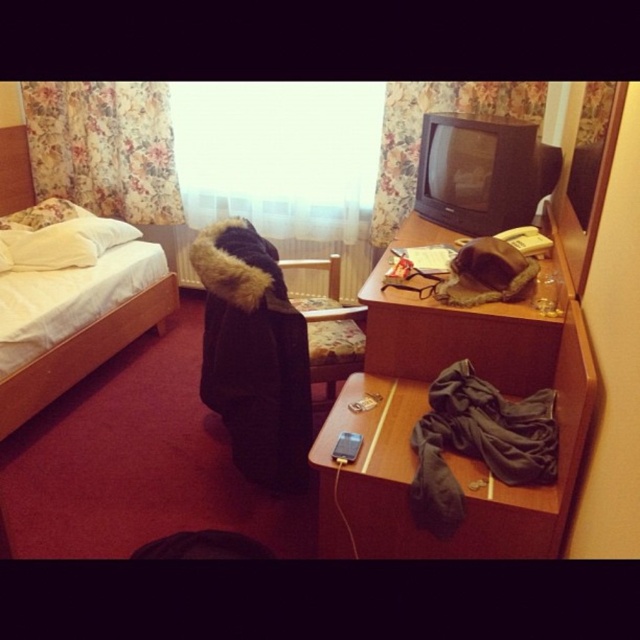
Question: Is wooden desk at center thinner than black fur-trimmed coat at center?

Choices:
 (A) no
 (B) yes

Answer: (A)

Question: Is white soft bed at left smaller than black fur-trimmed coat at center?

Choices:
 (A) yes
 (B) no

Answer: (B)

Question: Which object appears closest to the camera in this image?

Choices:
 (A) black fur-trimmed coat at center
 (B) wooden desk at center

Answer: (B)

Question: Which of the following is the closest to the observer?

Choices:
 (A) black fur-trimmed coat at center
 (B) wooden desk at center

Answer: (B)

Question: Which object is the closest to the white soft bed at left?

Choices:
 (A) black fur-trimmed coat at center
 (B) wooden desk at center

Answer: (A)

Question: Is wooden desk at center below black fur-trimmed coat at center?

Choices:
 (A) no
 (B) yes

Answer: (A)